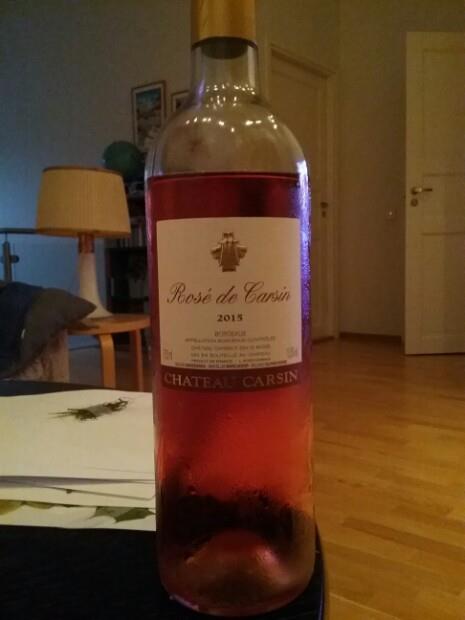
Image resolution: width=465 pixels, height=620 pixels. Find the location of `tan wooden end table`. tan wooden end table is located at coordinates (112, 325), (107, 350), (138, 353).